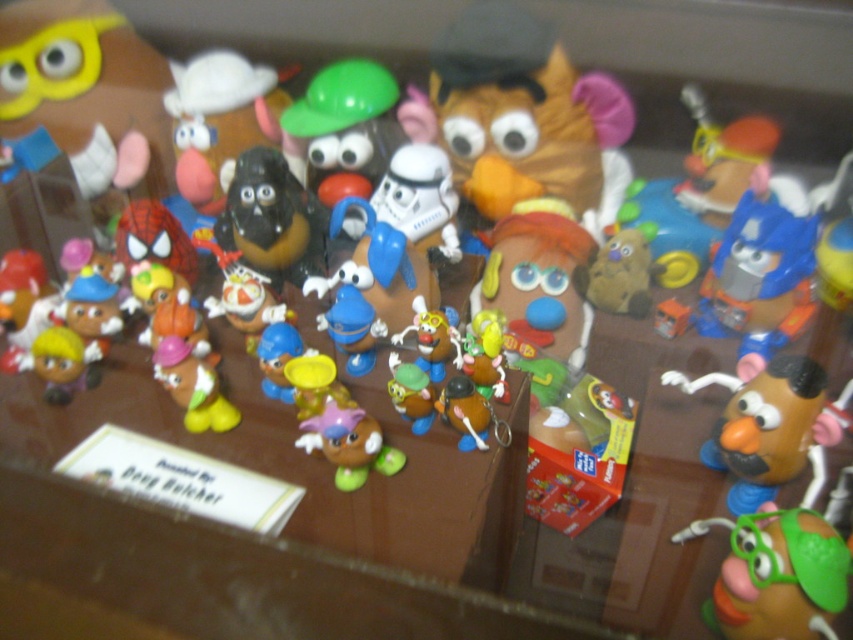
Question: Is matte brown potato at center bigger than blue matte toy at center?

Choices:
 (A) no
 (B) yes

Answer: (B)

Question: Which of the following is the closest to the observer?

Choices:
 (A) matte black figure at upper center
 (B) shiny black potato at center
 (C) green matte potato head at center
 (D) matte brown potato at center

Answer: (D)

Question: Does brown matte potato at center appear on the right side of blue plastic toy at center?

Choices:
 (A) no
 (B) yes

Answer: (B)

Question: Among these objects, which one is farthest from the camera?

Choices:
 (A) matte plastic potato at center
 (B) matte black figure at upper center
 (C) blue plastic toy at center
 (D) matte brown bear at center

Answer: (B)

Question: Considering the relative positions of brown matte potato at center and matte purple potato at center in the image provided, where is brown matte potato at center located with respect to matte purple potato at center?

Choices:
 (A) right
 (B) left

Answer: (A)

Question: Which object is farther from the camera taking this photo?

Choices:
 (A) green rubber potato at lower right
 (B) matte black figure at upper center
 (C) yellow matte potato at center
 (D) matte purple potato at center

Answer: (B)